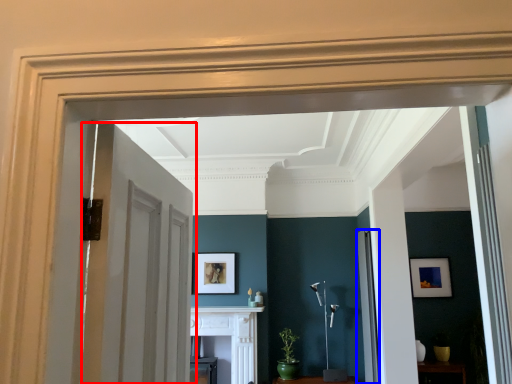
Question: Which of the following is the farthest to the observer, door (highlighted by a red box) or door (highlighted by a blue box)?

Choices:
 (A) door
 (B) door

Answer: (B)